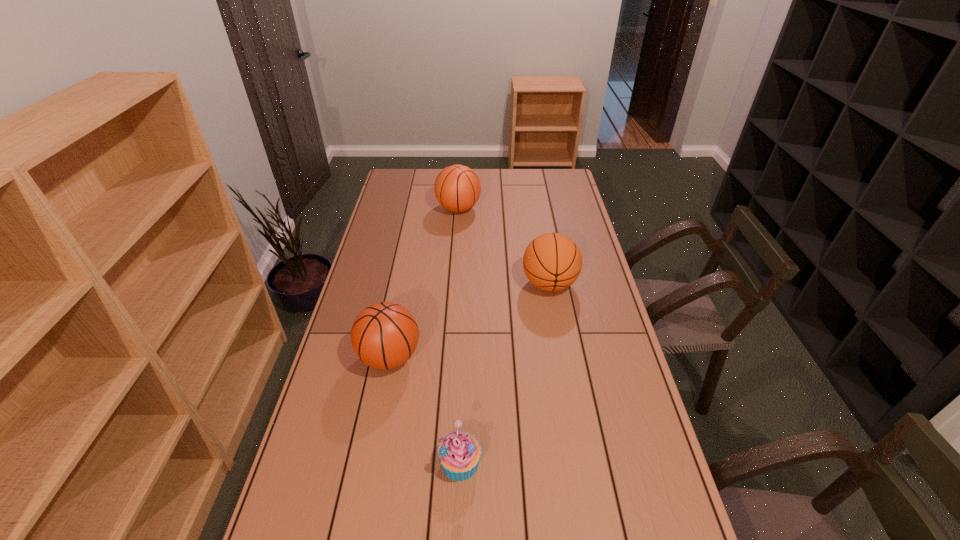
In order to click on unoccupied position between the farthest basketball and the second nearest object in this screenshot , I will do `click(424, 283)`.

Locate an element on the screen. This screenshot has width=960, height=540. empty space that is in between the muffin and the rightmost basketball is located at coordinates (505, 373).

Find the location of a particular element. vacant point located between the nearest basketball and the shortest object is located at coordinates (425, 410).

I want to click on free space between the second nearest object and the farthest object, so click(424, 283).

Where is `vacant area that lies between the third farthest object and the farthest basketball`? The height and width of the screenshot is (540, 960). vacant area that lies between the third farthest object and the farthest basketball is located at coordinates (424, 283).

The height and width of the screenshot is (540, 960). What are the coordinates of `unoccupied position between the farthest object and the second nearest object` in the screenshot? It's located at (424, 283).

Identify the location of free space between the shortest object and the second farthest object. This screenshot has height=540, width=960. (505, 373).

Where is `object that can be found as the third closest to the farthest object`? This screenshot has width=960, height=540. object that can be found as the third closest to the farthest object is located at coordinates coord(459,453).

Identify the location of object that can be found as the second closest to the second nearest object. This screenshot has height=540, width=960. (552, 262).

You are a GUI agent. You are given a task and a screenshot of the screen. Output one action in this format:
    pyautogui.click(x=<x>, y=<y>)
    Task: Click on the basketball that is the second closest to the third nearest object
    The image size is (960, 540).
    Given the screenshot: What is the action you would take?
    pyautogui.click(x=384, y=335)